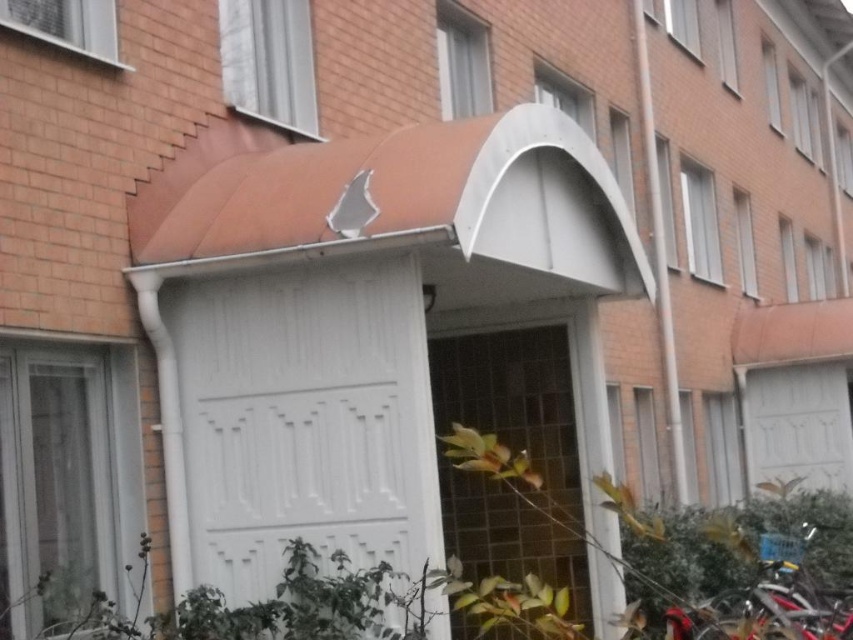
You are standing in front of the building entrance and need to locate the white painted wood garage door at center. According to the coordinates provided, where exactly should you look to find it?

The white painted wood garage door at center is located at the 2D coordinates point (305,419).

You are a delivery person arriving at the entrance of the brick building. You need to park your shiny red bicycle at lower right near the white painted wood garage door at center. Can you park the bicycle to the left side of the garage door?

The white painted wood garage door at center is to the left of the shiny red bicycle at lower right, so the bicycle is already positioned to the right of the garage door. Therefore, you cannot park the bicycle to the left side of the garage door as it is already on the right side.